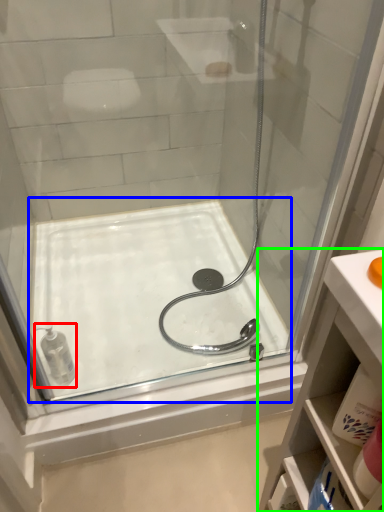
Question: Which object is positioned farthest from toiletry (highlighted by a red box)? Select from bath (highlighted by a blue box) and bathroom cabinet (highlighted by a green box).

Choices:
 (A) bath
 (B) bathroom cabinet

Answer: (B)